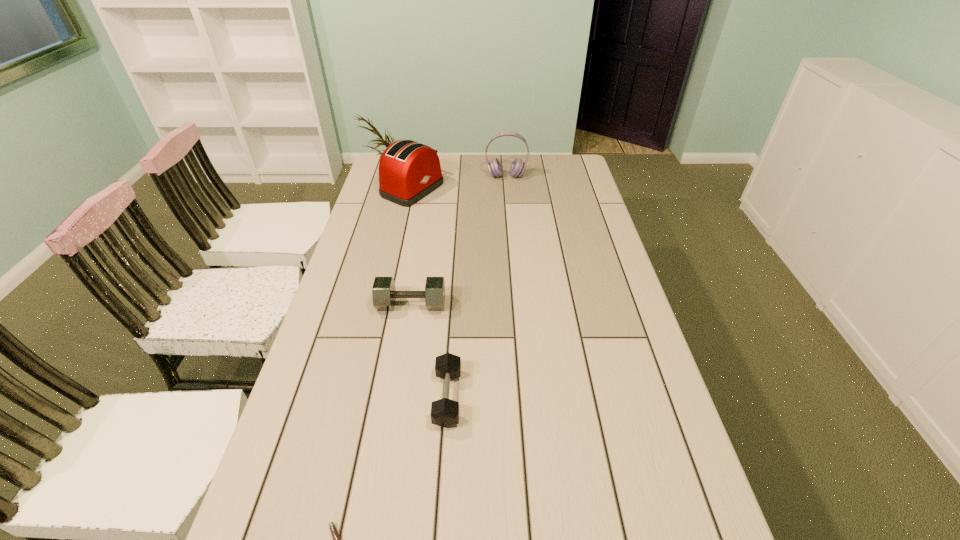
You are a GUI agent. You are given a task and a screenshot of the screen. Output one action in this format:
    pyautogui.click(x=<x>, y=<y>)
    Task: Click on the headset
    Image resolution: width=960 pixels, height=540 pixels.
    Given the screenshot: What is the action you would take?
    pyautogui.click(x=517, y=168)

Where is `toaster`? This screenshot has height=540, width=960. toaster is located at coordinates (408, 171).

Find the location of `the third farthest object`. the third farthest object is located at coordinates (384, 294).

You are a GUI agent. You are given a task and a screenshot of the screen. Output one action in this format:
    pyautogui.click(x=<x>, y=<y>)
    Task: Click on the taller dumbbell
    
    Given the screenshot: What is the action you would take?
    pyautogui.click(x=384, y=294)

Find the location of a particular element. The image size is (960, 540). the second nearest object is located at coordinates (444, 412).

What are the coordinates of `the nearer dumbbell` in the screenshot? It's located at (444, 412).

Locate an element on the screen. This screenshot has width=960, height=540. blank space located on the headband and ear cups of the headset is located at coordinates (511, 230).

Find the location of a particular element. The height and width of the screenshot is (540, 960). vacant region located on the right of the toaster is located at coordinates (510, 190).

Locate an element on the screen. The width and height of the screenshot is (960, 540). vacant area located 0.320m on the back of the third farthest object is located at coordinates (423, 231).

At what (x,y) coordinates should I click in order to perform the action: click on vacant region located on the left of the nearer dumbbell. Please return your answer as a coordinate pair (x, y). This screenshot has height=540, width=960. Looking at the image, I should click on (336, 397).